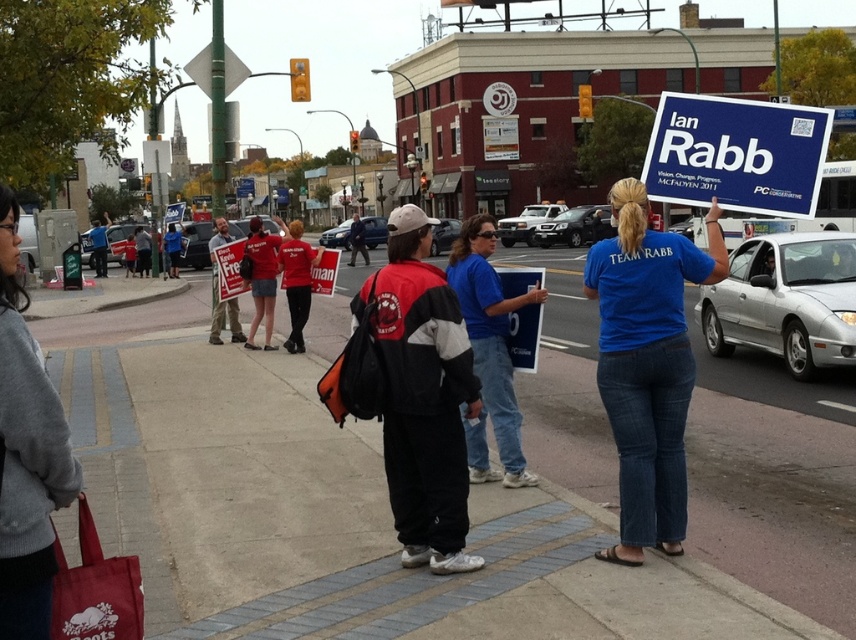
Who is more distant from viewer, (x=749, y=573) or (x=684, y=177)?

Positioned behind is point (x=684, y=177).

Is concrete sidewalk at center further to the viewer compared to blue cardboard sign at upper right?

No, it is in front of blue cardboard sign at upper right.

Is point (574, 486) behind point (739, 208)?

That is True.

Identify the location of concrete sidewalk at center. The image size is (856, 640). (217, 452).

Between point (544, 369) and point (435, 388), which one is positioned in front?

Point (435, 388)

Measure the distance between point (176, 349) and camera.

Point (176, 349) is 14.33 meters away from camera.

Identify the location of concrete sidewalk at center. (217, 452).

The width and height of the screenshot is (856, 640). What do you see at coordinates (217, 452) in the screenshot?
I see `concrete sidewalk at center` at bounding box center [217, 452].

Is concrete sidewalk at center below blue fabric sign at center?

No.

The image size is (856, 640). What do you see at coordinates (217, 452) in the screenshot? I see `concrete sidewalk at center` at bounding box center [217, 452].

Locate an element on the screen. Image resolution: width=856 pixels, height=640 pixels. concrete sidewalk at center is located at coordinates (217, 452).